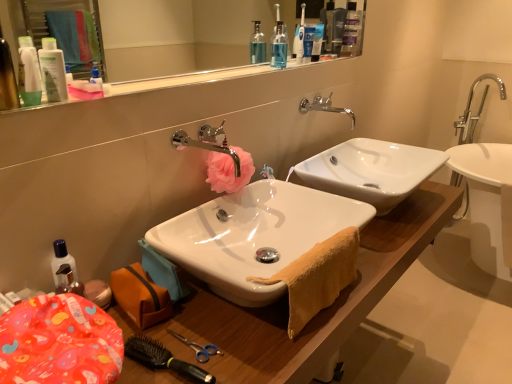
Where is `free region on the left part of yellow terry cloth towel at lower center`? The image size is (512, 384). free region on the left part of yellow terry cloth towel at lower center is located at coordinates (219, 320).